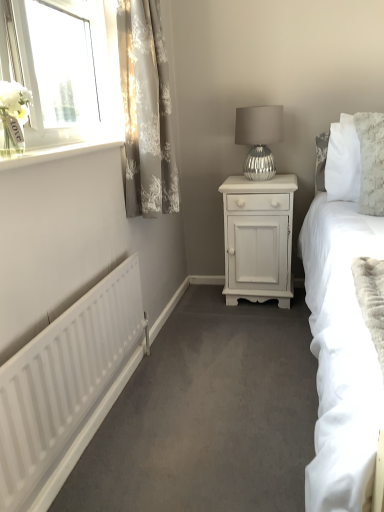
Where is `free region under silver textured lamp at center (from a real-world perspective)`? The image size is (384, 512). free region under silver textured lamp at center (from a real-world perspective) is located at coordinates (258, 180).